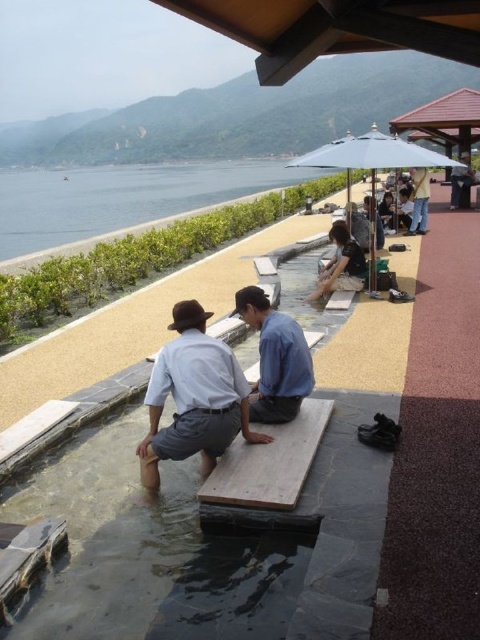
Does light blue shirt at center have a smaller size compared to matte blue umbrella at upper right?

Yes.

Is point (165, 376) more distant than point (380, 168)?

No, it is not.

Find the location of a particular element. The height and width of the screenshot is (640, 480). light blue shirt at center is located at coordinates (193, 397).

Does light blue shirt at center appear on the left side of light blue fabric umbrella at upper center?

Correct, you'll find light blue shirt at center to the left of light blue fabric umbrella at upper center.

Does light blue shirt at center have a greater height compared to light blue fabric umbrella at upper center?

Indeed, light blue shirt at center has a greater height compared to light blue fabric umbrella at upper center.

Is point (154, 490) less distant than point (468, 186)?

Yes.

Where is `light blue shirt at center`? light blue shirt at center is located at coordinates (193, 397).

The height and width of the screenshot is (640, 480). What are the coordinates of `light blue shirt at center` in the screenshot? It's located at (193, 397).

Locate an element on the screen. This screenshot has height=640, width=480. light blue shirt at center is located at coordinates (193, 397).